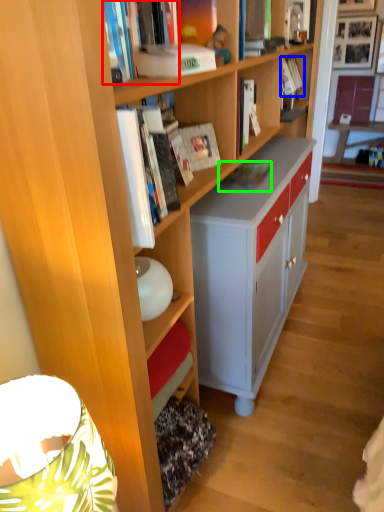
Question: Estimate the real-world distances between objects in this image. Which object is farther from book (highlighted by a red box), book (highlighted by a blue box) or book (highlighted by a green box)?

Choices:
 (A) book
 (B) book

Answer: (A)